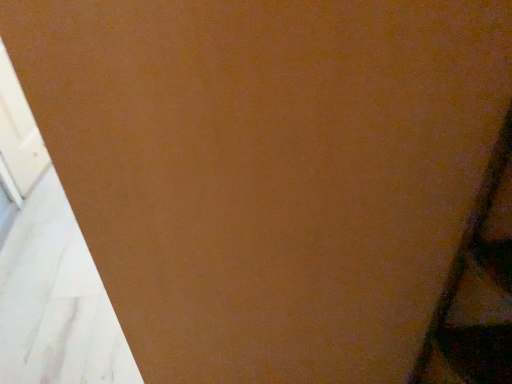
This screenshot has width=512, height=384. I want to click on clear glass window at lower left, so 7,202.

The width and height of the screenshot is (512, 384). Describe the element at coordinates (7, 202) in the screenshot. I see `clear glass window at lower left` at that location.

The width and height of the screenshot is (512, 384). In order to click on clear glass window at lower left in this screenshot , I will do `click(7, 202)`.